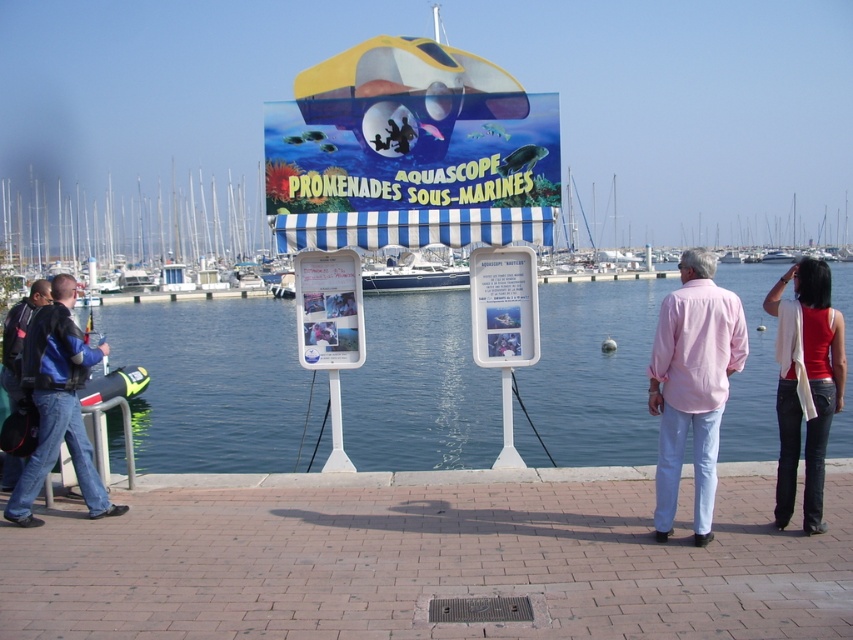
You are a photographer aiming to capture both the pink cotton shirt at center and the red cotton tank top at right in a single frame. Based on their positions, which shirt should you focus on first to ensure both are in the shot?

The pink cotton shirt at center is to the left of the red cotton tank top at right, so focusing on the pink cotton shirt at center first will allow you to frame both shirts within the camera view.

You are a photographer trying to capture both the pink cotton shirt at center and the red cotton tank top at right in a single frame. Based on their sizes, which one might appear closer to the camera in the photo?

The pink cotton shirt at center appears smaller than the red cotton tank top at right. In photography, objects that are smaller in the frame are typically farther away from the camera. Therefore, the pink cotton shirt at center would appear farther away, and the red cotton tank top at right would seem closer to the camera.